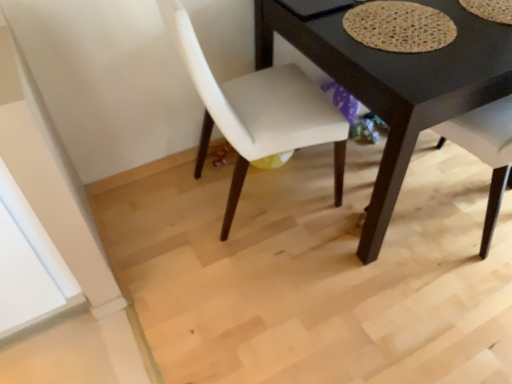
You are a GUI agent. You are given a task and a screenshot of the screen. Output one action in this format:
    pyautogui.click(x=<x>, y=<y>)
    Task: Click on the vacant space underneath white fabric chair at center (from a real-world perspective)
    This screenshot has height=384, width=512.
    Given the screenshot: What is the action you would take?
    pyautogui.click(x=255, y=200)